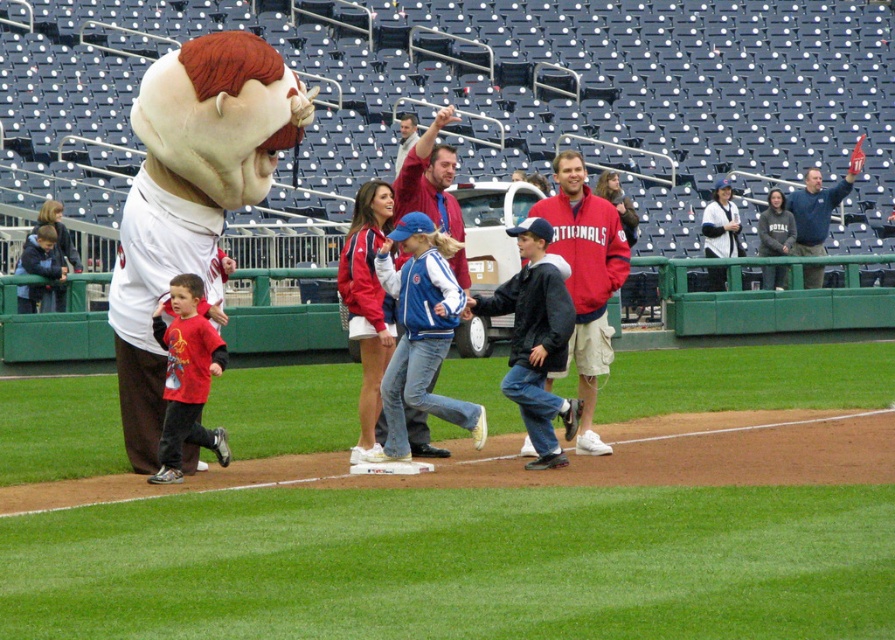
Describe the element at coordinates (721, 224) in the screenshot. The height and width of the screenshot is (640, 895). I see `white jacket at upper center` at that location.

Is white jacket at upper center smaller than dark gray hoodie at upper right?

Correct, white jacket at upper center occupies less space than dark gray hoodie at upper right.

Which is behind, point (722, 193) or point (789, 241)?

Positioned behind is point (722, 193).

In order to click on white jacket at upper center in this screenshot , I will do `click(721, 224)`.

Which is in front, point (568, 237) or point (757, 250)?

Point (568, 237) is more forward.

Can you confirm if reddish-brown fleece jacket at center is wider than dark gray hoodie at upper right?

Correct, the width of reddish-brown fleece jacket at center exceeds that of dark gray hoodie at upper right.

Is point (578, 387) positioned before point (780, 237)?

Yes, point (578, 387) is closer to viewer.

At what (x,y) coordinates should I click in order to perform the action: click on reddish-brown fleece jacket at center. Please return your answer as a coordinate pair (x, y). This screenshot has height=640, width=895. Looking at the image, I should click on (586, 276).

Does black jacket at center appear on the right side of white jacket at upper center?

No, black jacket at center is not to the right of white jacket at upper center.

What do you see at coordinates (537, 339) in the screenshot?
I see `black jacket at center` at bounding box center [537, 339].

The image size is (895, 640). Identify the location of black jacket at center. (537, 339).